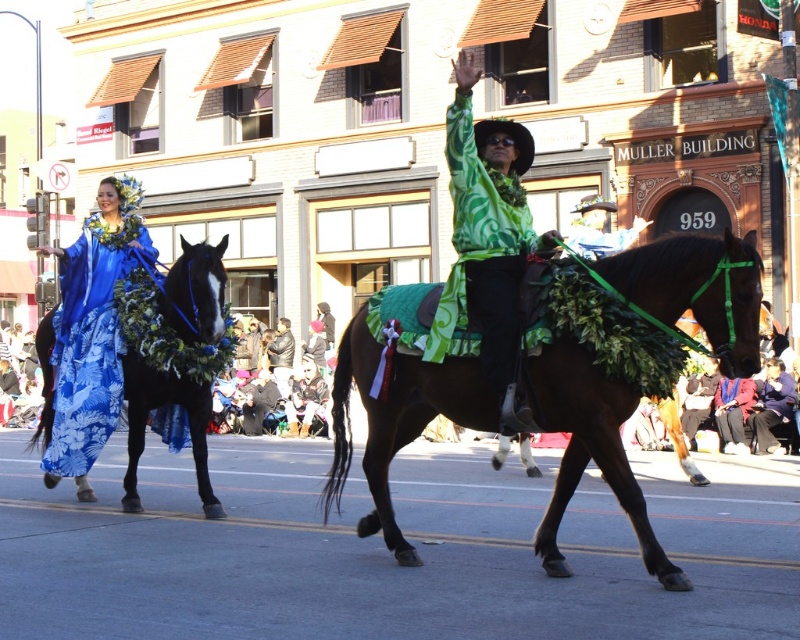
What do you see at coordinates (488, 230) in the screenshot? I see `green satin shirt at center` at bounding box center [488, 230].

Can you confirm if green satin shirt at center is smaller than black leather jacket at center?

Yes.

Where is `green satin shirt at center`? The width and height of the screenshot is (800, 640). green satin shirt at center is located at coordinates (488, 230).

The height and width of the screenshot is (640, 800). I want to click on green satin shirt at center, so click(488, 230).

Is green fabric horse at center behind green satin shirt at center?

Yes.

Is point (393, 380) behind point (488, 371)?

Yes, point (393, 380) is farther from viewer.

The width and height of the screenshot is (800, 640). Identify the location of green fabric horse at center. (396, 419).

Which of these two, green fabric horse at center or black leather jacket at center, stands taller?

With more height is green fabric horse at center.

Can you confirm if green fabric horse at center is thinner than black leather jacket at center?

No, green fabric horse at center is not thinner than black leather jacket at center.

Is point (462, 362) farther from camera compared to point (285, 378)?

No.

Locate an element on the screen. This screenshot has width=800, height=640. green fabric horse at center is located at coordinates tap(396, 419).